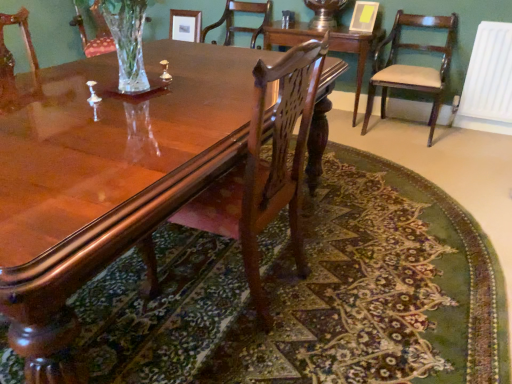
Image resolution: width=512 pixels, height=384 pixels. Identify the location of vacant area that is in front of mahogany wood chair at right, placed as the first chair when sorted from right to left. (412, 150).